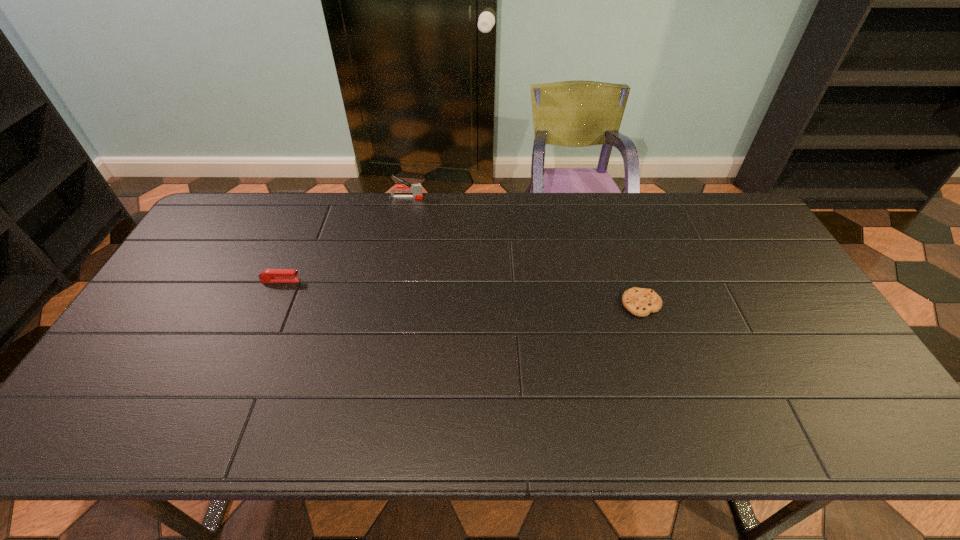
In the image, there is a desktop. Where is `vacant space at the far edge`? This screenshot has height=540, width=960. vacant space at the far edge is located at coordinates (362, 214).

Image resolution: width=960 pixels, height=540 pixels. In the image, there is a desktop. Find the location of `vacant region at the near edge`. vacant region at the near edge is located at coordinates (196, 424).

Image resolution: width=960 pixels, height=540 pixels. In the image, there is a desktop. What are the coordinates of `free space at the right edge` in the screenshot? It's located at (768, 286).

In the image, there is a desktop. Where is `vacant space at the near right corner`? vacant space at the near right corner is located at coordinates (826, 420).

This screenshot has height=540, width=960. I want to click on vacant space that's between the second object from left to right and the second tallest object, so click(344, 239).

Locate an element on the screen. empty space that is in between the right stapler and the cookie is located at coordinates (523, 251).

You are a GUI agent. You are given a task and a screenshot of the screen. Output one action in this format:
    pyautogui.click(x=<x>, y=<y>)
    Task: Click on the vacant space that's between the shortest object and the taller stapler
    
    Given the screenshot: What is the action you would take?
    pyautogui.click(x=523, y=251)

Where is `vacant area between the shortest object and the farther stapler`? The width and height of the screenshot is (960, 540). vacant area between the shortest object and the farther stapler is located at coordinates (523, 251).

I want to click on empty location between the shortest object and the nearer stapler, so click(x=461, y=293).

Where is `free space between the cookie and the nearer stapler`? The height and width of the screenshot is (540, 960). free space between the cookie and the nearer stapler is located at coordinates (461, 293).